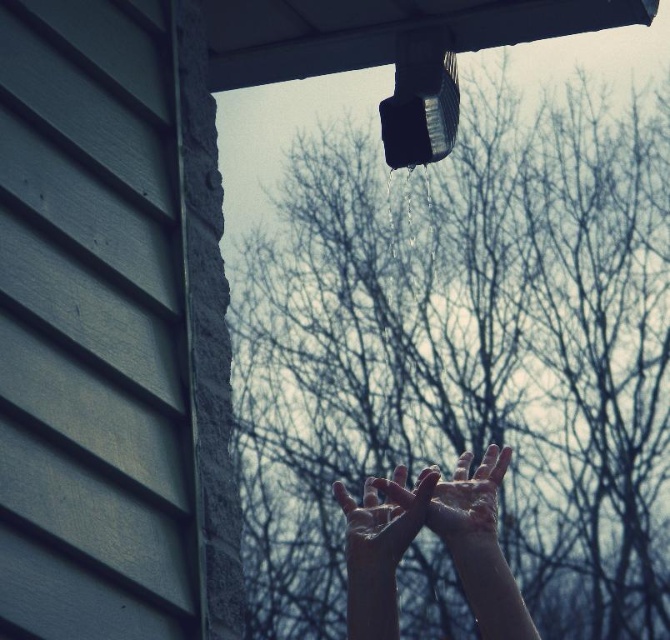
You are trying to catch water from the downspout with your hands. Based on the scene, which of the two hand positions shown in the image would allow you to collect more water? The options are the wet skin hands at center or the smooth skin hands at center.

The wet skin hands at center might be wider than smooth skin hands at center, so the wet skin hands at center would likely collect more water due to their wider surface area.

You are trying to catch water from the downspout with your hands. Based on the scene, which part of your hands is more wet? The slightly wet skin at center or the wet skin hands at center?

The slightly wet skin at center is more wet because it has a larger size compared to the wet skin hands at center.